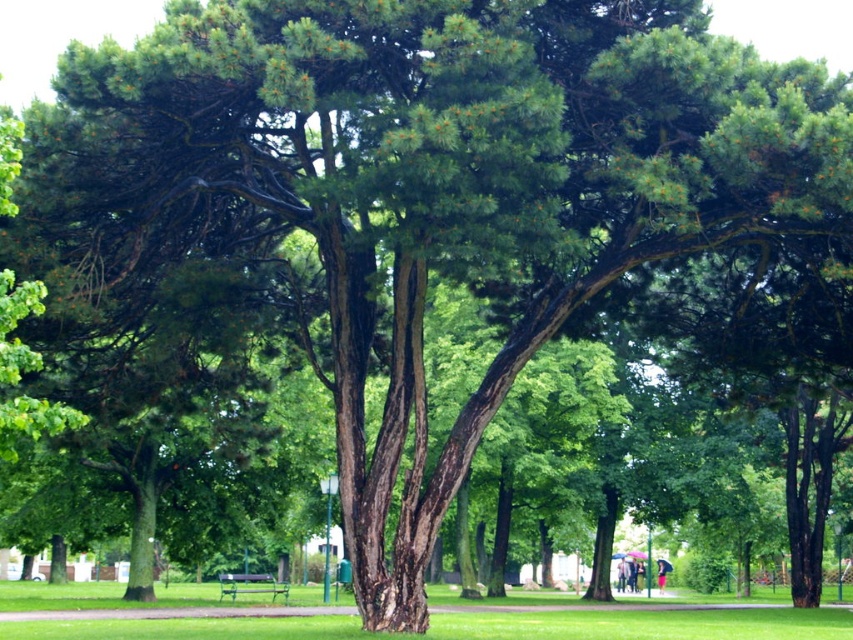
Who is lower down, green grass at center or wooden park bench at center?

wooden park bench at center is below.

Is point (329, 630) closer to viewer compared to point (219, 588)?

That is True.

Locate an element on the screen. This screenshot has width=853, height=640. green grass at center is located at coordinates coord(473,625).